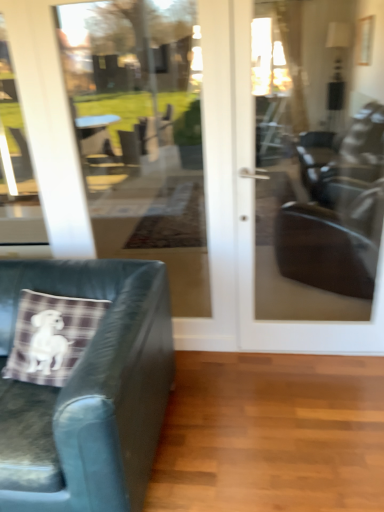
Question: Does matte glass door at center have a greater width compared to leather cushion at left?

Choices:
 (A) no
 (B) yes

Answer: (A)

Question: Is matte glass door at center positioned far away from leather cushion at left?

Choices:
 (A) yes
 (B) no

Answer: (B)

Question: Is matte glass door at center further to the viewer compared to leather cushion at left?

Choices:
 (A) no
 (B) yes

Answer: (B)

Question: Is matte glass door at center oriented towards leather cushion at left?

Choices:
 (A) no
 (B) yes

Answer: (A)

Question: Is matte glass door at center outside leather cushion at left?

Choices:
 (A) yes
 (B) no

Answer: (A)

Question: From the image's perspective, does matte glass door at center appear higher than leather cushion at left?

Choices:
 (A) no
 (B) yes

Answer: (B)

Question: Does leather cushion at left appear on the left side of transparent glass door at center?

Choices:
 (A) yes
 (B) no

Answer: (A)

Question: Can you confirm if leather cushion at left is bigger than transparent glass door at center?

Choices:
 (A) yes
 (B) no

Answer: (A)

Question: Is leather cushion at left not within transparent glass door at center?

Choices:
 (A) yes
 (B) no

Answer: (A)

Question: Is leather cushion at left at the right side of transparent glass door at center?

Choices:
 (A) yes
 (B) no

Answer: (B)

Question: Considering the relative positions of leather cushion at left and transparent glass door at center in the image provided, is leather cushion at left behind transparent glass door at center?

Choices:
 (A) yes
 (B) no

Answer: (B)

Question: From the image's perspective, is leather cushion at left located above transparent glass door at center?

Choices:
 (A) yes
 (B) no

Answer: (B)

Question: Is plaid fabric pillow at lower left smaller than leather cushion at left?

Choices:
 (A) yes
 (B) no

Answer: (A)